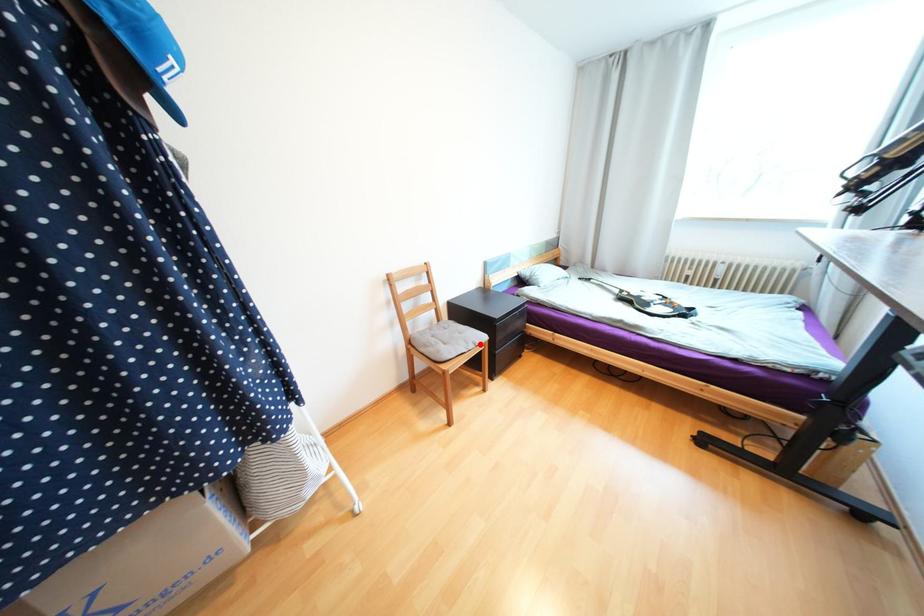
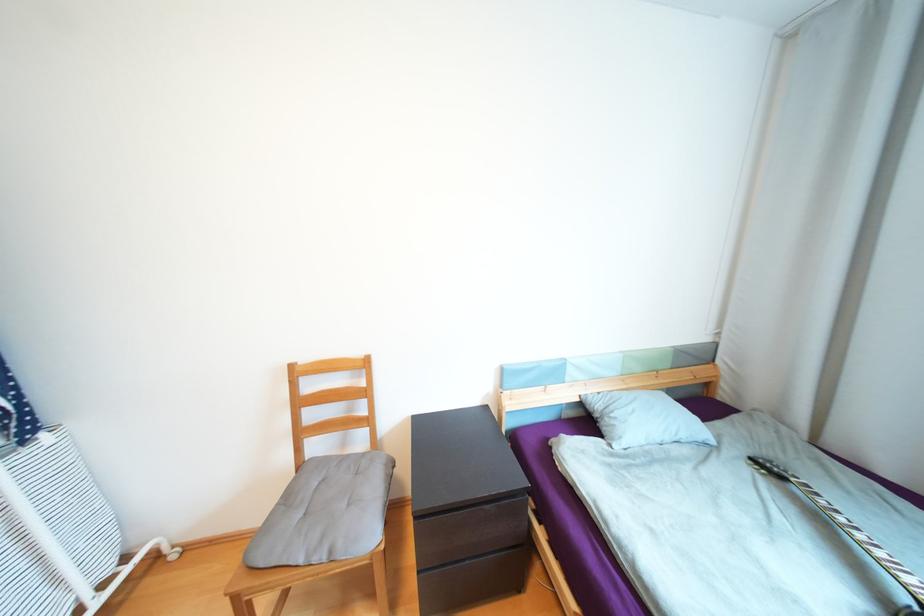
Locate, in the second image, the point that corresponds to the highlighted location in the first image.

(335, 553)